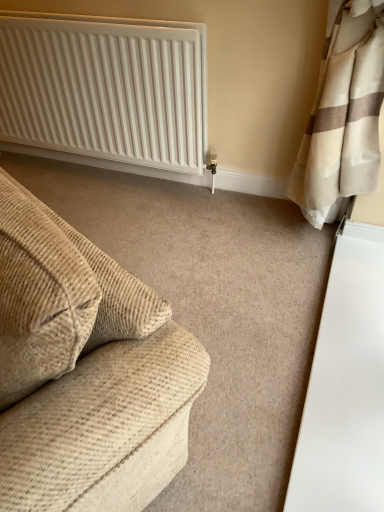
Question: Is beige corduroy couch at left not inside white ribbed radiator at upper left?

Choices:
 (A) no
 (B) yes

Answer: (B)

Question: From a real-world perspective, is beige corduroy couch at left over white ribbed radiator at upper left?

Choices:
 (A) no
 (B) yes

Answer: (B)

Question: Is beige corduroy couch at left positioned before white ribbed radiator at upper left?

Choices:
 (A) no
 (B) yes

Answer: (B)

Question: Is white ribbed radiator at upper left at the back of beige corduroy couch at left?

Choices:
 (A) no
 (B) yes

Answer: (A)

Question: Is beige corduroy couch at left oriented towards white ribbed radiator at upper left?

Choices:
 (A) no
 (B) yes

Answer: (A)

Question: Is beige corduroy couch at left thinner than white ribbed radiator at upper left?

Choices:
 (A) yes
 (B) no

Answer: (B)

Question: From a real-world perspective, is white ribbed radiator at upper left over beige corduroy couch at left?

Choices:
 (A) no
 (B) yes

Answer: (A)

Question: Does white ribbed radiator at upper left have a greater height compared to beige corduroy couch at left?

Choices:
 (A) yes
 (B) no

Answer: (A)

Question: Is there a large distance between white ribbed radiator at upper left and beige corduroy couch at left?

Choices:
 (A) yes
 (B) no

Answer: (A)

Question: Is white ribbed radiator at upper left facing towards beige corduroy couch at left?

Choices:
 (A) no
 (B) yes

Answer: (B)

Question: Are white ribbed radiator at upper left and beige corduroy couch at left beside each other?

Choices:
 (A) yes
 (B) no

Answer: (B)

Question: Can you confirm if white ribbed radiator at upper left is thinner than beige corduroy couch at left?

Choices:
 (A) yes
 (B) no

Answer: (A)

Question: In terms of width, does beige corduroy couch at left look wider or thinner when compared to white ribbed radiator at upper left?

Choices:
 (A) wide
 (B) thin

Answer: (A)